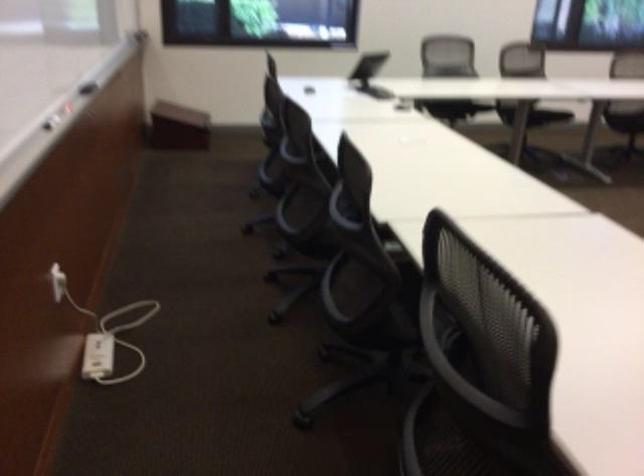
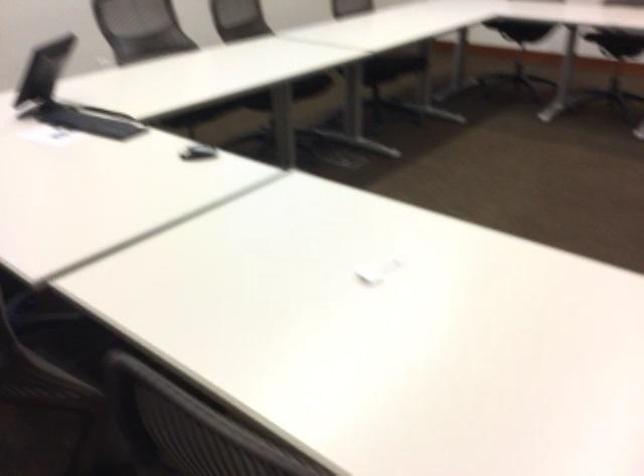
The first image is from the beginning of the video and the second image is from the end. How did the camera likely rotate when shooting the video?

The camera's rotation is toward right-down.